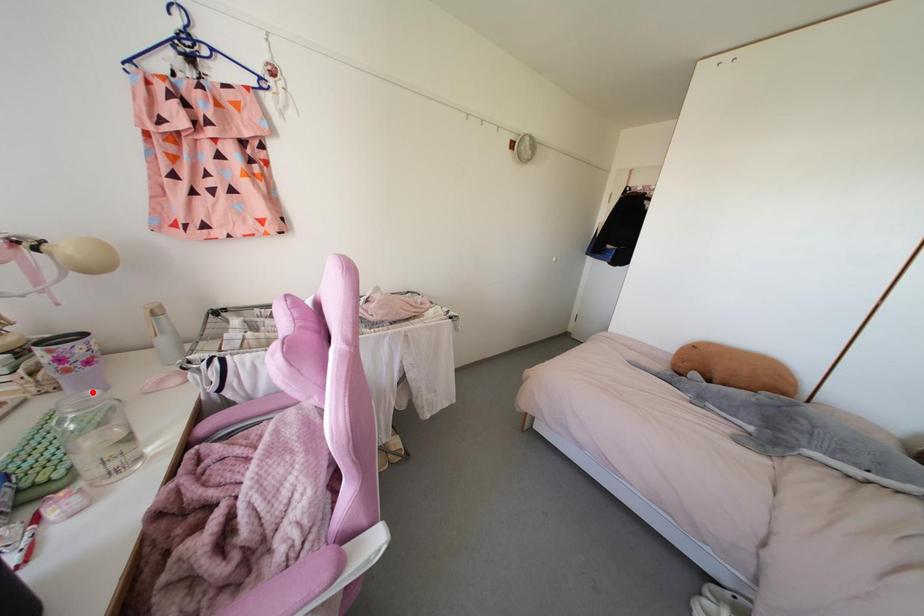
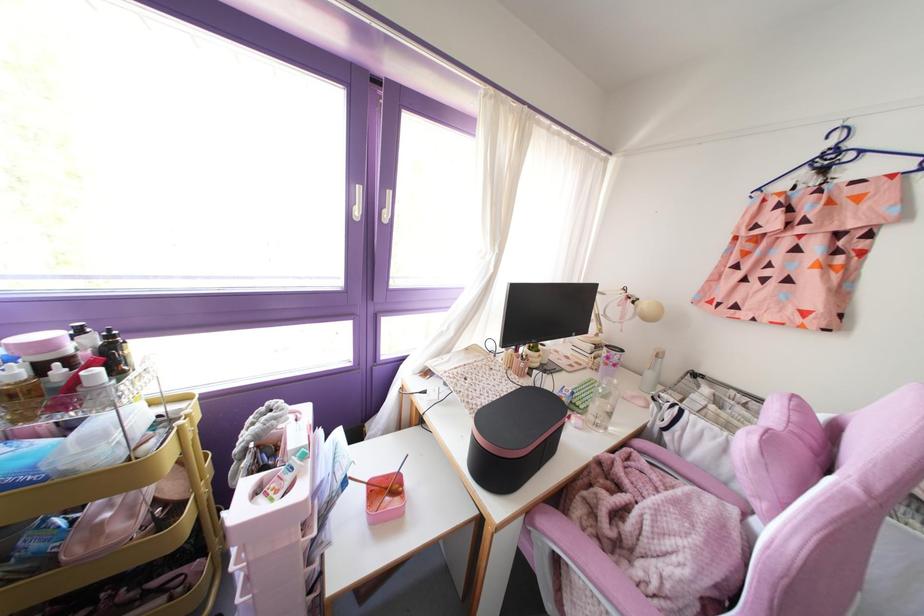
Locate, in the second image, the point that corresponds to the highlighted location in the first image.

(614, 381)